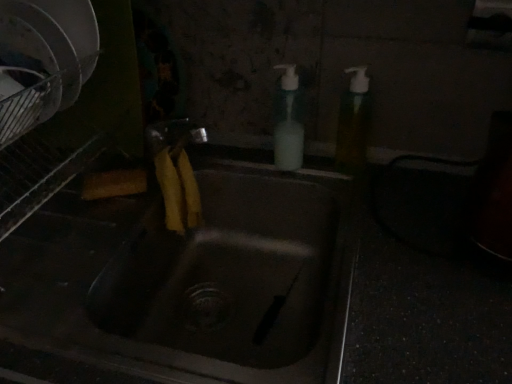
Question: Considering the positions of matte stainless steel sink at center and translucent plastic soap dispenser at upper right, marked as the 1th soap dispenser in a right-to-left arrangement, in the image, is matte stainless steel sink at center bigger or smaller than translucent plastic soap dispenser at upper right, marked as the 1th soap dispenser in a right-to-left arrangement,?

Choices:
 (A) big
 (B) small

Answer: (A)

Question: Would you say matte stainless steel sink at center is inside or outside translucent plastic soap dispenser at upper right, which appears as the second soap dispenser when viewed from the left?

Choices:
 (A) outside
 (B) inside

Answer: (A)

Question: Which of these objects is positioned farthest from the white plastic soap dispenser at upper center, which appears as the 2th soap dispenser when viewed from the right?

Choices:
 (A) translucent plastic soap dispenser at upper right, marked as the 1th soap dispenser in a right-to-left arrangement
 (B) matte stainless steel sink at center

Answer: (B)

Question: Considering the real-world distances, which object is farthest from the matte stainless steel sink at center?

Choices:
 (A) white plastic soap dispenser at upper center, arranged as the 1th soap dispenser when viewed from the left
 (B) translucent plastic soap dispenser at upper right, which appears as the second soap dispenser when viewed from the left

Answer: (B)